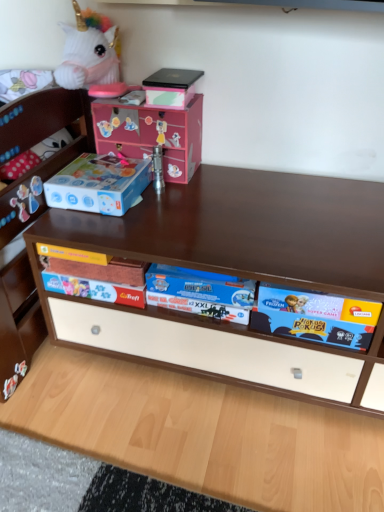
At what (x,y) coordinates should I click in order to perform the action: click on vacant area in front of pink cardboard box at upper center. Please return your answer as a coordinate pair (x, y). Looking at the image, I should click on (174, 199).